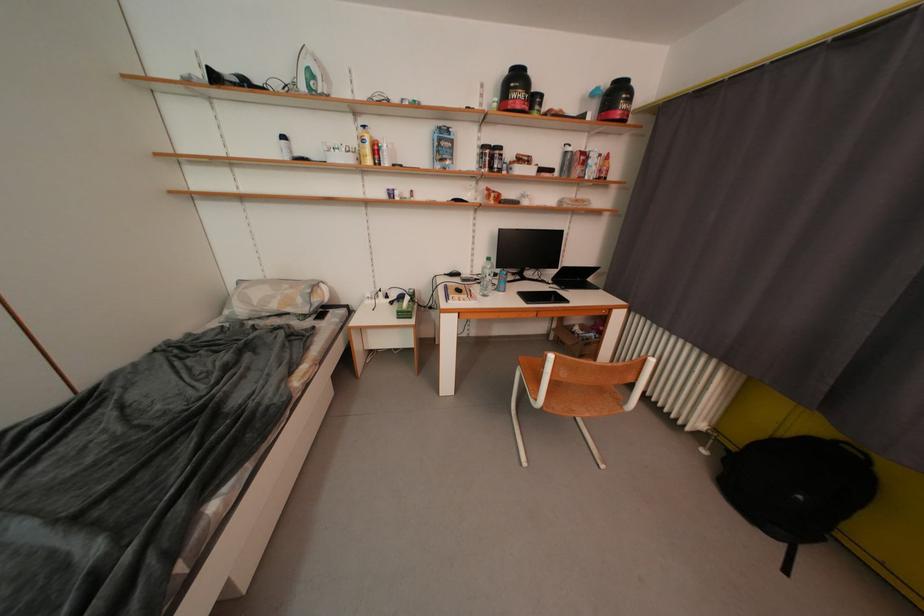
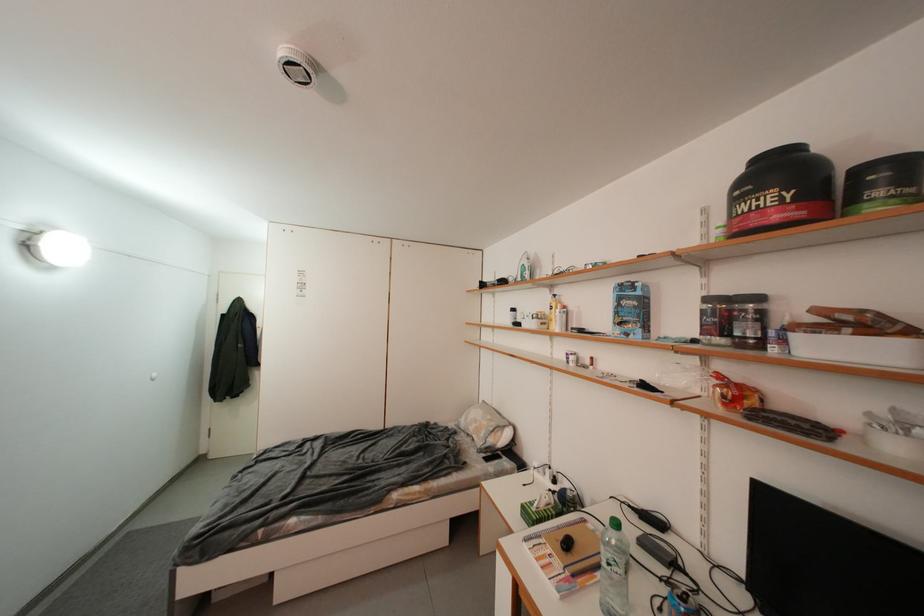
Question: I am providing you with two images of the same scene from different viewpoints. Which of the following objects are not visible in image2?

Choices:
 (A) supplement jar lid
 (B) black whey container
 (C) bag of bread
 (D) none of these

Answer: (D)